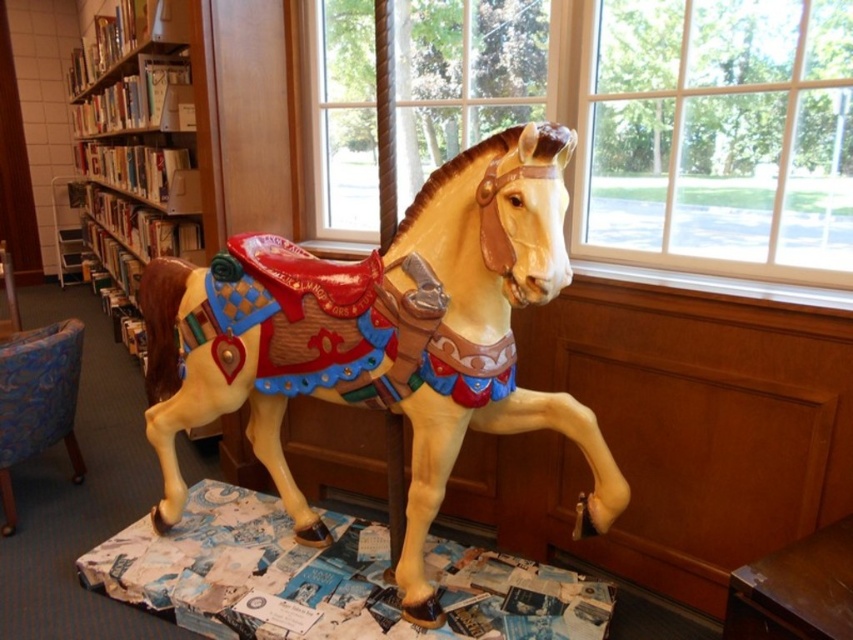
You are a visitor in the library and want to sit down on the blue fabric chair at lower left. To reach it, you must walk around the wooden bookcase at left. Which direction should you move relative to the bookcase to get to the chair?

The wooden bookcase at left is to the left of the blue fabric chair at lower left. To reach the chair, you should move to the right side of the wooden bookcase at left.

You are sitting in the blue fabric chair at lower left and want to look outside through the clear glass window at center. Can you see the window directly in front of you?

The clear glass window at center is positioned on the right side of blue fabric chair at lower left, so you would need to turn to your right to see it.

You are standing in the library and want to look outside through the clear glass window at center. Can you see the carousel horse painted in light cream color with brown accents in your view when looking through the window?

The clear glass window at center is located at point (666, 132), so yes, you can see the carousel horse painted in light cream color with brown accents through the window since it is positioned near the window.